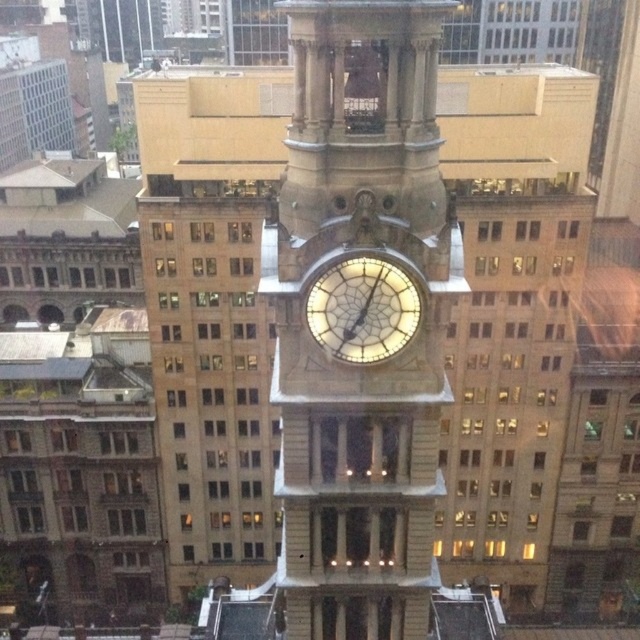
Question: Does golden stone clock tower at center have a smaller size compared to illuminated glass clock at center?

Choices:
 (A) yes
 (B) no

Answer: (B)

Question: Which point appears closest to the camera in this image?

Choices:
 (A) (333, 529)
 (B) (381, 308)

Answer: (B)

Question: Among these points, which one is nearest to the camera?

Choices:
 (A) (300, 172)
 (B) (410, 296)

Answer: (B)

Question: Which object is farther from the camera taking this photo?

Choices:
 (A) golden stone clock tower at center
 (B) illuminated glass clock at center

Answer: (B)

Question: Can you confirm if golden stone clock tower at center is smaller than illuminated glass clock at center?

Choices:
 (A) no
 (B) yes

Answer: (A)

Question: Can you confirm if golden stone clock tower at center is positioned below illuminated glass clock at center?

Choices:
 (A) yes
 (B) no

Answer: (A)